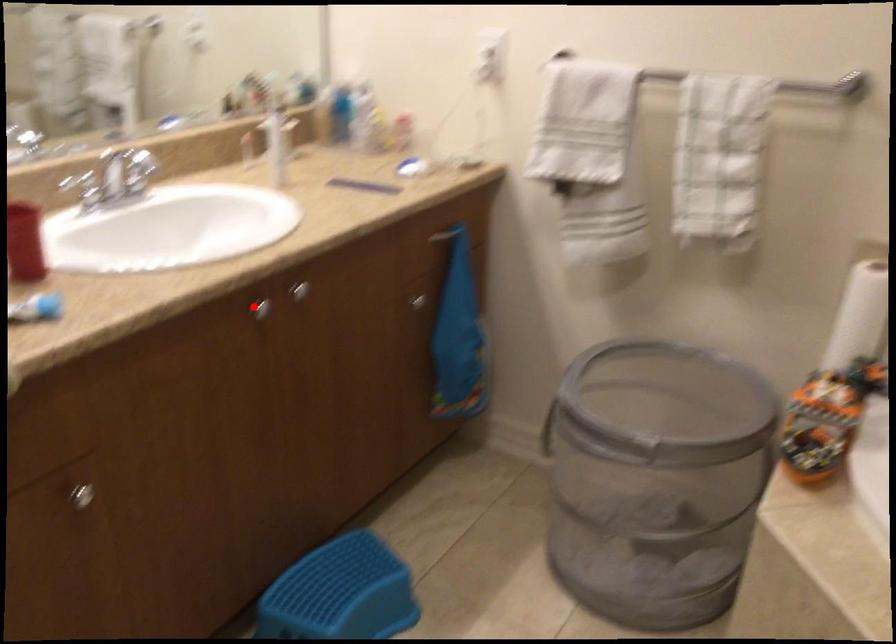
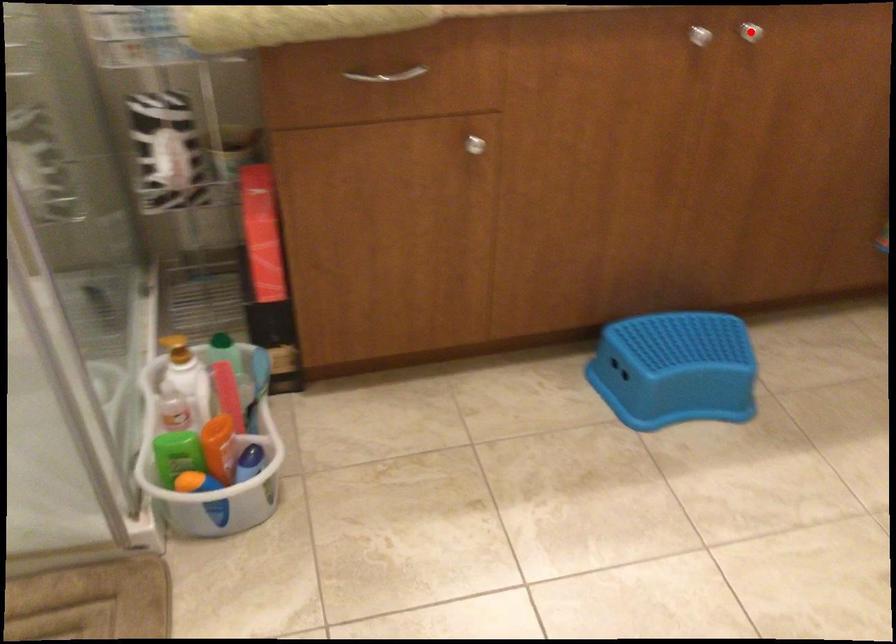
Based on the photo, I am providing you with two images of the same scene from different viewpoints. A red point is marked on the first image and another point is marked on the second image. Is the marked point in image1 the same physical position as the marked point in image2?

No